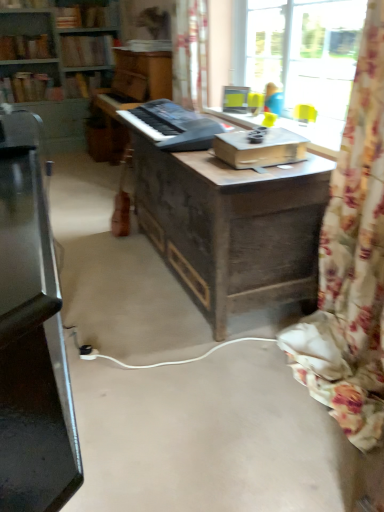
Question: Is hardcover book at upper left, which is the 2th book from top to bottom, smaller than hardcover book at upper left, arranged as the first book when ordered from the bottom?

Choices:
 (A) no
 (B) yes

Answer: (B)

Question: Considering the relative positions of hardcover book at upper left, which ranks as the 5th book in bottom-to-top order, and hardcover book at upper left, which is the sixth book in top-to-bottom order, in the image provided, is hardcover book at upper left, which ranks as the 5th book in bottom-to-top order, to the right of hardcover book at upper left, which is the sixth book in top-to-bottom order, from the viewer's perspective?

Choices:
 (A) no
 (B) yes

Answer: (B)

Question: From the image's perspective, is hardcover book at upper left, which ranks as the 5th book in bottom-to-top order, under hardcover book at upper left, arranged as the first book when ordered from the bottom?

Choices:
 (A) yes
 (B) no

Answer: (B)

Question: Considering the relative sizes of hardcover book at upper left, which ranks as the 5th book in bottom-to-top order, and hardcover book at upper left, which is the sixth book in top-to-bottom order, in the image provided, is hardcover book at upper left, which ranks as the 5th book in bottom-to-top order, taller than hardcover book at upper left, which is the sixth book in top-to-bottom order,?

Choices:
 (A) yes
 (B) no

Answer: (B)

Question: Is hardcover book at upper left, which is the sixth book in top-to-bottom order, at the back of hardcover book at upper left, which ranks as the 5th book in bottom-to-top order?

Choices:
 (A) no
 (B) yes

Answer: (A)

Question: Is hardcover book at upper left, marked as the 6th book in a bottom-to-top arrangement, in front of or behind wooden bookcase at upper left in the image?

Choices:
 (A) behind
 (B) front

Answer: (A)

Question: Considering the relative positions of hardcover book at upper left, which appears as the first book when viewed from the top, and wooden bookcase at upper left in the image provided, is hardcover book at upper left, which appears as the first book when viewed from the top, to the left or to the right of wooden bookcase at upper left?

Choices:
 (A) left
 (B) right

Answer: (A)

Question: Does point (36, 0) appear closer or farther from the camera than point (11, 93)?

Choices:
 (A) farther
 (B) closer

Answer: (B)

Question: From the image's perspective, is hardcover book at upper left, which appears as the first book when viewed from the top, positioned above or below wooden bookcase at upper left?

Choices:
 (A) above
 (B) below

Answer: (A)

Question: Is black plastic keyboard at center in front of or behind wooden bookcase at upper left in the image?

Choices:
 (A) front
 (B) behind

Answer: (A)

Question: In terms of width, does black plastic keyboard at center look wider or thinner when compared to wooden bookcase at upper left?

Choices:
 (A) wide
 (B) thin

Answer: (B)

Question: From the image's perspective, relative to wooden bookcase at upper left, is black plastic keyboard at center above or below?

Choices:
 (A) below
 (B) above

Answer: (A)

Question: Considering the positions of point (187, 150) and point (14, 26), is point (187, 150) closer or farther from the camera than point (14, 26)?

Choices:
 (A) closer
 (B) farther

Answer: (A)

Question: Is hardcover book at upper left, marked as the 6th book in a bottom-to-top arrangement, spatially inside hardcover book at upper left, which ranks as the 5th book in bottom-to-top order, or outside of it?

Choices:
 (A) outside
 (B) inside

Answer: (A)

Question: Looking at the image, does hardcover book at upper left, marked as the 6th book in a bottom-to-top arrangement, seem bigger or smaller compared to hardcover book at upper left, which is the 2th book from top to bottom?

Choices:
 (A) small
 (B) big

Answer: (A)